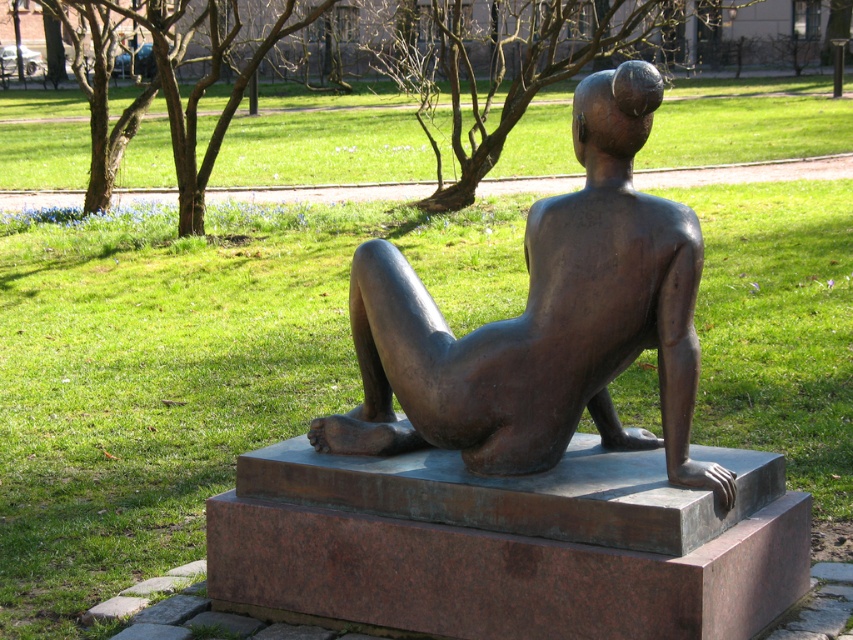
You are a gardener planning to mow the green grass at upper center near the bronze statue at center. Can you mow the grass without hitting the statue?

The bronze statue at center is positioned under the green grass at upper center, so the statue is located beneath the grass area. Therefore, mowing the grass at upper center would not interfere with the statue since it is underneath.

You are standing at the entrance of the park and want to find the bronze statue at center. According to the coordinates provided, in which direction should you walk to reach it?

The bronze statue at center is located at coordinates point (543,321). Since the coordinates are in the center, you should walk straight ahead from the entrance to reach it.

You are standing in front of the bronze sculpture and want to determine the relative positions of two points on the sculpture. The first point is at coordinate point (590,154) and the second is at point (248,180). Which point is nearer to your current position?

Point (590,154) is closer to the viewer than point (248,180).